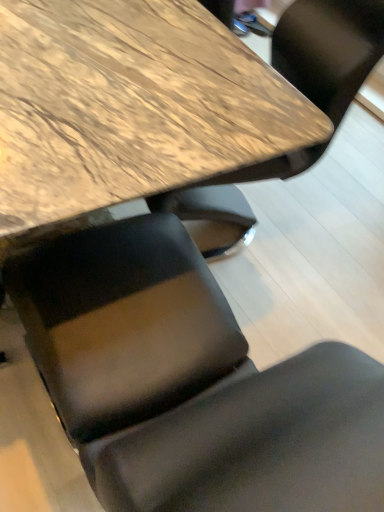
Question: Is matte black chair at lower center with wooden table at upper center?

Choices:
 (A) yes
 (B) no

Answer: (B)

Question: Does matte black chair at lower center appear on the right side of wooden table at upper center?

Choices:
 (A) yes
 (B) no

Answer: (A)

Question: Is matte black chair at lower center not close to wooden table at upper center?

Choices:
 (A) no
 (B) yes

Answer: (A)

Question: Is wooden table at upper center completely or partially inside matte black chair at lower center?

Choices:
 (A) yes
 (B) no

Answer: (B)

Question: Is matte black chair at lower center turned away from wooden table at upper center?

Choices:
 (A) yes
 (B) no

Answer: (B)

Question: Can you confirm if matte black chair at lower center is bigger than wooden table at upper center?

Choices:
 (A) yes
 (B) no

Answer: (B)

Question: Could you tell me if wooden table at upper center is facing matte black chair at lower center?

Choices:
 (A) no
 (B) yes

Answer: (B)

Question: Is wooden table at upper center further to the viewer compared to matte black chair at lower center?

Choices:
 (A) yes
 (B) no

Answer: (A)

Question: Can you confirm if wooden table at upper center is positioned to the left of matte black chair at lower center?

Choices:
 (A) no
 (B) yes

Answer: (B)

Question: Is wooden table at upper center to the right of matte black chair at lower center from the viewer's perspective?

Choices:
 (A) no
 (B) yes

Answer: (A)

Question: Is wooden table at upper center looking in the opposite direction of matte black chair at lower center?

Choices:
 (A) no
 (B) yes

Answer: (A)

Question: From a real-world perspective, is wooden table at upper center on top of matte black chair at lower center?

Choices:
 (A) no
 (B) yes

Answer: (A)

Question: Considering the positions of matte black chair at lower center and wooden table at upper center in the image, is matte black chair at lower center taller or shorter than wooden table at upper center?

Choices:
 (A) short
 (B) tall

Answer: (B)